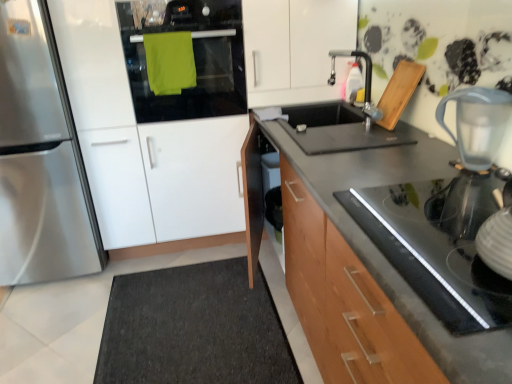
Question: Does dark gray carpet at lower left come behind green matte oven at upper left?

Choices:
 (A) no
 (B) yes

Answer: (A)

Question: From the image's perspective, is dark gray carpet at lower left located beneath green matte oven at upper left?

Choices:
 (A) yes
 (B) no

Answer: (A)

Question: Is dark gray carpet at lower left facing away from green matte oven at upper left?

Choices:
 (A) no
 (B) yes

Answer: (A)

Question: Considering the relative sizes of dark gray carpet at lower left and green matte oven at upper left in the image provided, is dark gray carpet at lower left taller than green matte oven at upper left?

Choices:
 (A) no
 (B) yes

Answer: (A)

Question: Considering the relative sizes of dark gray carpet at lower left and green matte oven at upper left in the image provided, is dark gray carpet at lower left wider than green matte oven at upper left?

Choices:
 (A) yes
 (B) no

Answer: (A)

Question: In the image, is satin silver refrigerator at left on the left side or the right side of dark gray carpet at lower left?

Choices:
 (A) left
 (B) right

Answer: (A)

Question: Looking at their shapes, would you say satin silver refrigerator at left is wider or thinner than dark gray carpet at lower left?

Choices:
 (A) thin
 (B) wide

Answer: (A)

Question: Does point (24, 48) appear closer or farther from the camera than point (159, 382)?

Choices:
 (A) closer
 (B) farther

Answer: (B)

Question: Is satin silver refrigerator at left in front of or behind dark gray carpet at lower left in the image?

Choices:
 (A) behind
 (B) front

Answer: (A)

Question: In terms of height, does satin silver refrigerator at left look taller or shorter compared to green matte oven at upper left?

Choices:
 (A) short
 (B) tall

Answer: (B)

Question: Would you say satin silver refrigerator at left is inside or outside green matte oven at upper left?

Choices:
 (A) outside
 (B) inside

Answer: (A)

Question: Does point (0, 170) appear closer or farther from the camera than point (194, 109)?

Choices:
 (A) closer
 (B) farther

Answer: (A)

Question: Is satin silver refrigerator at left to the left or to the right of green matte oven at upper left in the image?

Choices:
 (A) left
 (B) right

Answer: (A)

Question: From the image's perspective, is transparent plastic pitcher at upper right above or below dark gray carpet at lower left?

Choices:
 (A) below
 (B) above

Answer: (B)

Question: Is transparent plastic pitcher at upper right bigger or smaller than dark gray carpet at lower left?

Choices:
 (A) small
 (B) big

Answer: (A)